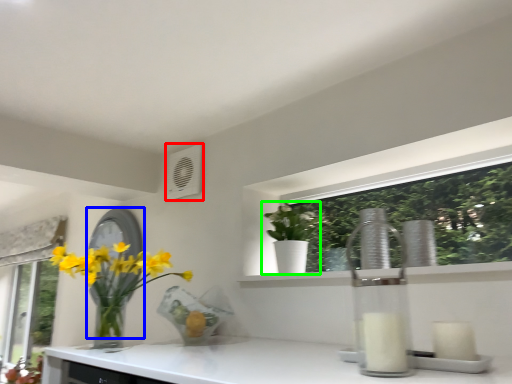
Question: Which object is positioned closest to air conditioning (highlighted by a red box)? Select from mirror (highlighted by a blue box) and houseplant (highlighted by a green box).

Choices:
 (A) mirror
 (B) houseplant

Answer: (A)